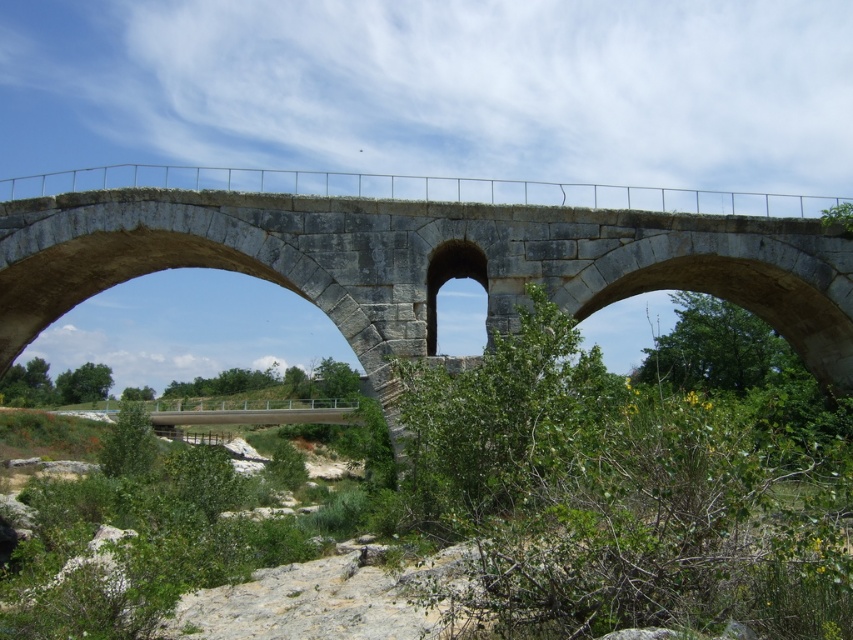
You are standing on the gray stone arch at center and want to pick a flower from the green leafy bush at center. Which direction should you face to reach it?

The green leafy bush at center is positioned on the right side of the gray stone arch at center, so you should face to the right to reach it.

You are a hiker standing on the path near the gray stone bridge at center and the green leafy bush at center. Which object is closer to you?

The gray stone bridge at center is closer to you because the green leafy bush at center is behind it.

What are the coordinates of the gray stone bridge at center?

The gray stone bridge at center is located at coordinates point (421, 250).